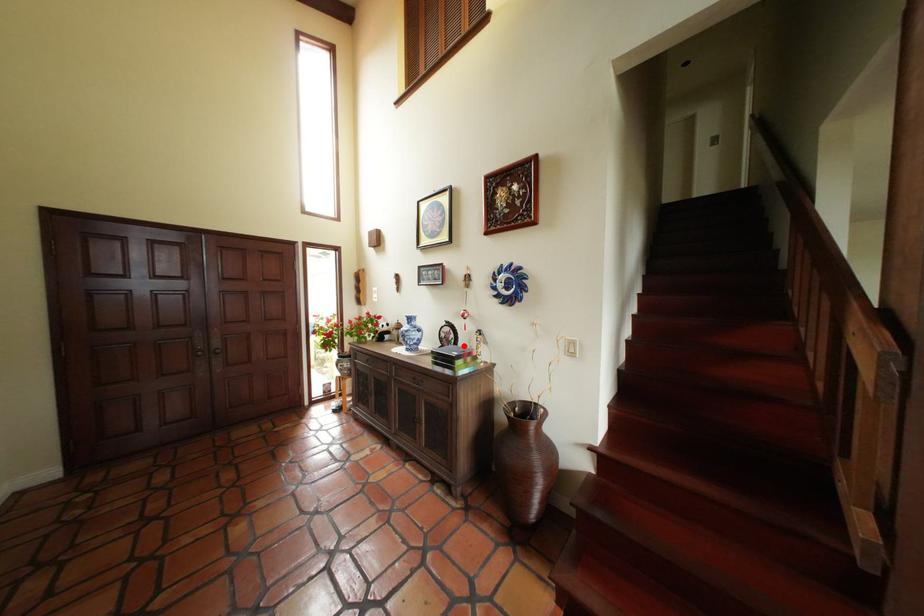
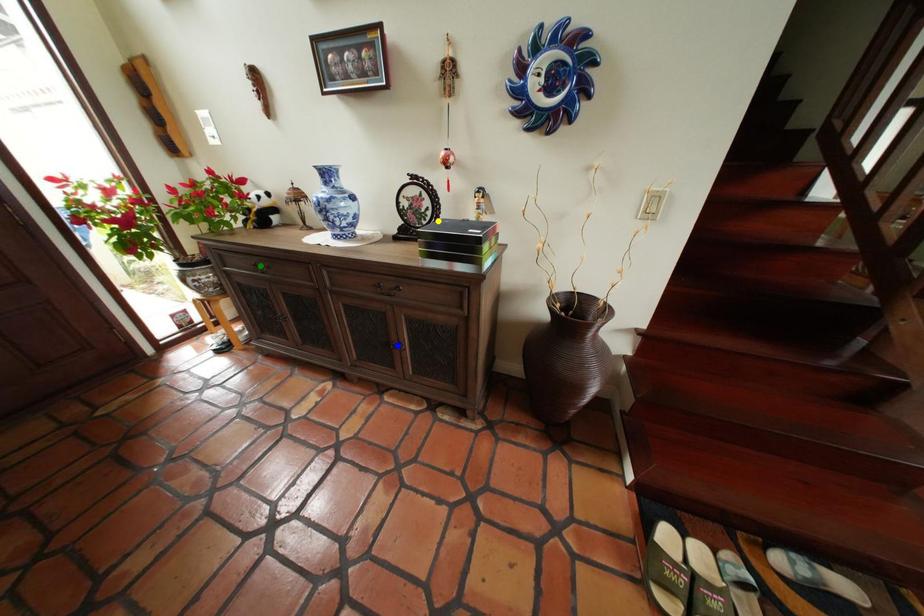
Question: I am providing you with two images of the same scene from different viewpoints. A red point is marked on the first image. You are given multiple points on the second image. In image 2, which mark is for the same physical point as the one in image 1?

Choices:
 (A) blue point
 (B) yellow point
 (C) green point

Answer: (B)